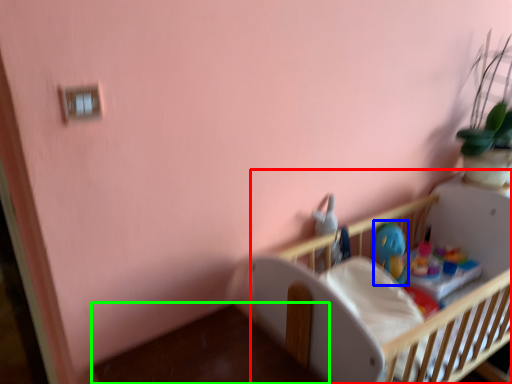
Question: Which object is positioned farthest from infant bed (highlighted by a red box)? Select from toy (highlighted by a blue box) and table (highlighted by a green box).

Choices:
 (A) toy
 (B) table

Answer: (B)